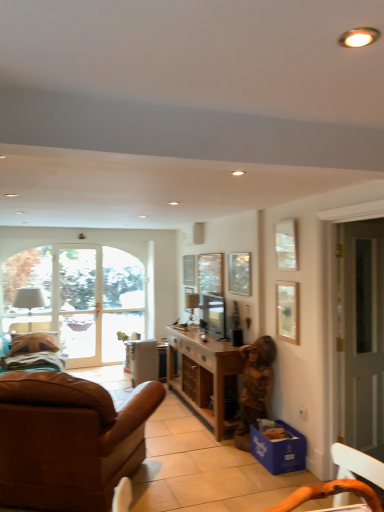
At what (x,y) coordinates should I click in order to perform the action: click on empty space that is to the right of brown leather couch at lower left. Please return your answer as a coordinate pair (x, y). The height and width of the screenshot is (512, 384). Looking at the image, I should click on (211, 476).